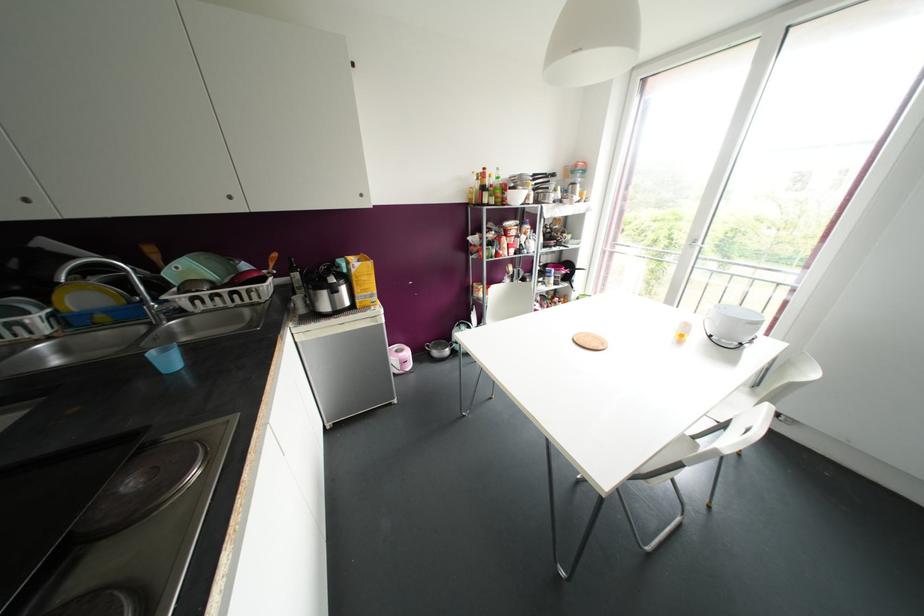
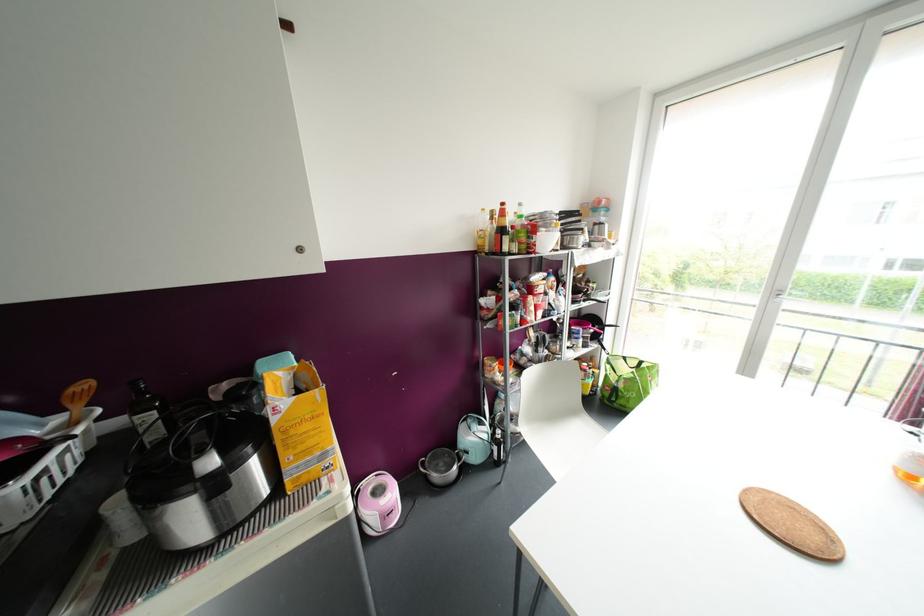
Question: What movement of the cameraman would produce the second image?

Choices:
 (A) Left
 (B) Right
 (C) Forward
 (D) Backward

Answer: (C)